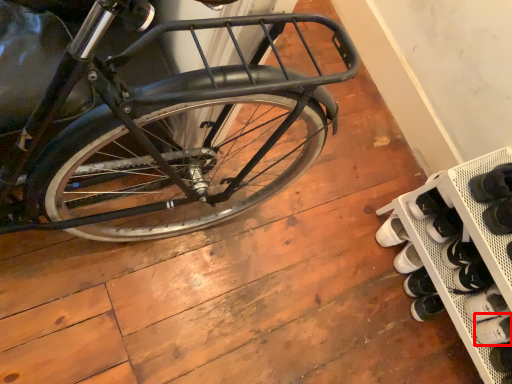
Question: In this image, where is shoe (annotated by the red box) located relative to shelf?

Choices:
 (A) left
 (B) right

Answer: (B)